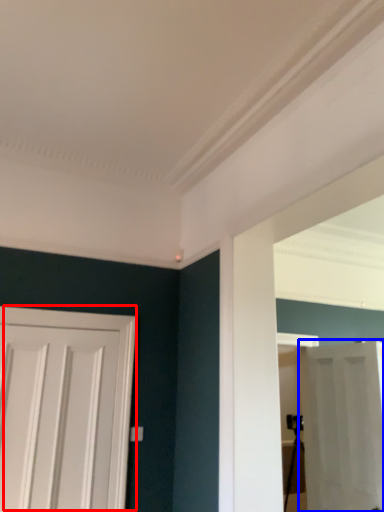
Question: Which of the following is the farthest to the observer, door (highlighted by a red box) or door (highlighted by a blue box)?

Choices:
 (A) door
 (B) door

Answer: (B)